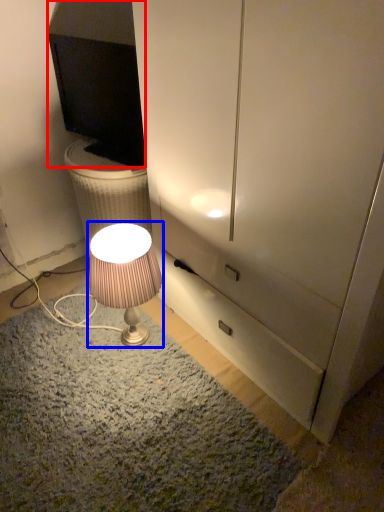
Question: Which point is closer to the camera, television (highlighted by a red box) or lamp (highlighted by a blue box)?

Choices:
 (A) television
 (B) lamp

Answer: (B)